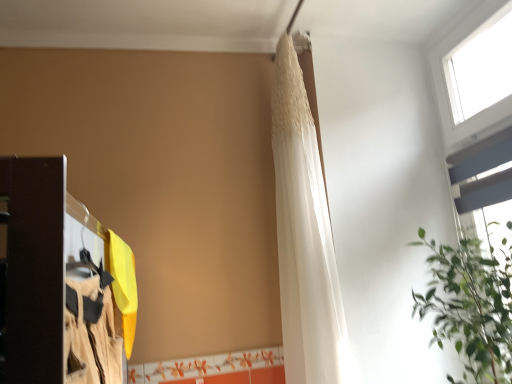
Question: Does white sheer fabric at upper center have a smaller size compared to green leafy plant at upper right?

Choices:
 (A) yes
 (B) no

Answer: (A)

Question: Is white sheer fabric at upper center far away from green leafy plant at upper right?

Choices:
 (A) no
 (B) yes

Answer: (A)

Question: Is green leafy plant at upper right at the back of white sheer fabric at upper center?

Choices:
 (A) no
 (B) yes

Answer: (A)

Question: Can you confirm if white sheer fabric at upper center is thinner than green leafy plant at upper right?

Choices:
 (A) no
 (B) yes

Answer: (B)

Question: From the image's perspective, would you say white sheer fabric at upper center is positioned over green leafy plant at upper right?

Choices:
 (A) no
 (B) yes

Answer: (B)

Question: Is white sheer fabric at upper center shorter than green leafy plant at upper right?

Choices:
 (A) yes
 (B) no

Answer: (B)

Question: From a real-world perspective, is white plastic window at upper right on green leafy plant at upper right?

Choices:
 (A) no
 (B) yes

Answer: (B)

Question: Considering the relative sizes of white plastic window at upper right and green leafy plant at upper right in the image provided, is white plastic window at upper right wider than green leafy plant at upper right?

Choices:
 (A) no
 (B) yes

Answer: (A)

Question: Does white plastic window at upper right turn towards green leafy plant at upper right?

Choices:
 (A) yes
 (B) no

Answer: (B)

Question: Does white plastic window at upper right have a lesser height compared to green leafy plant at upper right?

Choices:
 (A) yes
 (B) no

Answer: (B)

Question: Would you consider white plastic window at upper right to be distant from green leafy plant at upper right?

Choices:
 (A) yes
 (B) no

Answer: (B)

Question: Is green leafy plant at upper right surrounded by white plastic window at upper right?

Choices:
 (A) no
 (B) yes

Answer: (A)

Question: Is white plastic window at upper right positioned in front of white sheer fabric at upper center?

Choices:
 (A) no
 (B) yes

Answer: (B)